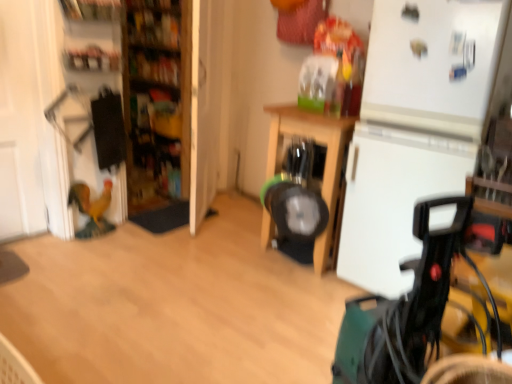
Question: From their relative heights in the image, would you say wooden shelves at left is taller or shorter than matte plastic shelf at upper left, the 1th shelf from the bottom?

Choices:
 (A) short
 (B) tall

Answer: (B)

Question: Is wooden shelves at left to the left or to the right of matte plastic shelf at upper left, arranged as the second shelf when viewed from the top, in the image?

Choices:
 (A) right
 (B) left

Answer: (A)

Question: Estimate the real-world distances between objects in this image. Which object is farther from the wooden bookshelf at upper left, marked as the 1th shelf in a top-to-bottom arrangement?

Choices:
 (A) green plastic baby carriage at lower right
 (B) wooden shelves at left
 (C) matte plastic shelf at upper left, the 1th shelf from the bottom
 (D) white matte refrigerator at right
 (E) wooden table at center

Answer: (A)

Question: Based on their relative distances, which object is farther from the matte plastic shelf at upper left, the 1th shelf from the bottom?

Choices:
 (A) wooden table at center
 (B) wooden shelves at left
 (C) white matte refrigerator at right
 (D) green plastic baby carriage at lower right
 (E) wooden bookshelf at upper left, marked as the 1th shelf in a top-to-bottom arrangement

Answer: (D)